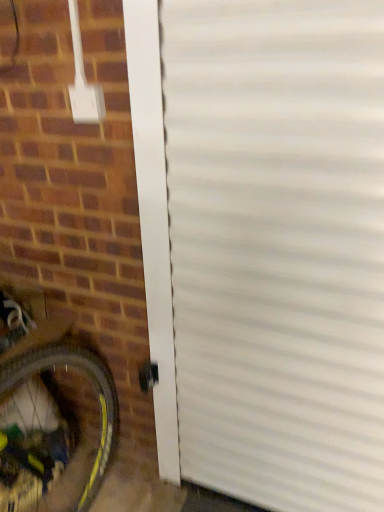
Locate an element on the screen. white corrugated door at center is located at coordinates (278, 247).

The image size is (384, 512). I want to click on brown brick at lower left, so click(77, 195).

You are a GUI agent. You are given a task and a screenshot of the screen. Output one action in this format:
    pyautogui.click(x=<x>, y=<y>)
    Task: Click on the white corrugated door at center
    
    Given the screenshot: What is the action you would take?
    click(x=278, y=247)

From the image's perspective, is white corrugated door at center under yellow rubber bicycle wheel at lower left?

No, from the image's perspective, white corrugated door at center is not below yellow rubber bicycle wheel at lower left.

Looking at this image, from a real-world perspective, is white corrugated door at center beneath yellow rubber bicycle wheel at lower left?

No, from a real-world perspective, white corrugated door at center is not under yellow rubber bicycle wheel at lower left.

Is the surface of white corrugated door at center in direct contact with yellow rubber bicycle wheel at lower left?

No.

The height and width of the screenshot is (512, 384). Identify the location of garage door lying in front of the yellow rubber bicycle wheel at lower left. (278, 247).

Is brown brick at lower left inside yellow rubber bicycle wheel at lower left?

No, brown brick at lower left is not a part of yellow rubber bicycle wheel at lower left.

Looking at their sizes, would you say yellow rubber bicycle wheel at lower left is wider or thinner than brown brick at lower left?

In the image, yellow rubber bicycle wheel at lower left appears to be more narrow than brown brick at lower left.

In the scene shown: Is yellow rubber bicycle wheel at lower left at the left side of brown brick at lower left?

Indeed, yellow rubber bicycle wheel at lower left is positioned on the left side of brown brick at lower left.

Is the surface of yellow rubber bicycle wheel at lower left in direct contact with brown brick at lower left?

yellow rubber bicycle wheel at lower left and brown brick at lower left are clearly separated.

Looking at this image, does yellow rubber bicycle wheel at lower left come in front of white corrugated door at center?

No.

Identify the location of garage door on the right of yellow rubber bicycle wheel at lower left. The width and height of the screenshot is (384, 512). (278, 247).

Consider the image. Considering the relative sizes of yellow rubber bicycle wheel at lower left and white corrugated door at center in the image provided, is yellow rubber bicycle wheel at lower left smaller than white corrugated door at center?

Result: Incorrect, yellow rubber bicycle wheel at lower left is not smaller in size than white corrugated door at center.

Considering the relative sizes of yellow rubber bicycle wheel at lower left and white corrugated door at center in the image provided, is yellow rubber bicycle wheel at lower left wider than white corrugated door at center?

Correct, the width of yellow rubber bicycle wheel at lower left exceeds that of white corrugated door at center.

Is white corrugated door at center to the left or to the right of brown brick at lower left in the image?

white corrugated door at center is to the right of brown brick at lower left.

Is point (366, 106) closer or farther from the camera than point (144, 312)?

Point (366, 106) is positioned closer to the camera compared to point (144, 312).

Is white corrugated door at center in contact with brown brick at lower left?

No, white corrugated door at center is not making contact with brown brick at lower left.

From the image's perspective, which one is positioned higher, white corrugated door at center or brown brick at lower left?

From the image's view, white corrugated door at center is above.

Looking at this image, from a real-world perspective, who is located lower, brown brick at lower left or white corrugated door at center?

brown brick at lower left is physically lower.

How different are the orientations of brown brick at lower left and white corrugated door at center in degrees?

87.1 degrees.

Is the depth of brown brick at lower left less than that of white corrugated door at center?

Yes, it is.

Between brown brick at lower left and white corrugated door at center, which one has less height?

brown brick at lower left is shorter.

From a real-world perspective, is brown brick at lower left located beneath yellow rubber bicycle wheel at lower left?

Actually, brown brick at lower left is physically above yellow rubber bicycle wheel at lower left in the real world.

Is brown brick at lower left thinner than yellow rubber bicycle wheel at lower left?

No, brown brick at lower left is not thinner than yellow rubber bicycle wheel at lower left.

Can you confirm if brown brick at lower left is positioned to the right of yellow rubber bicycle wheel at lower left?

Yes.

Who is shorter, brown brick at lower left or yellow rubber bicycle wheel at lower left?

Standing shorter between the two is yellow rubber bicycle wheel at lower left.

The height and width of the screenshot is (512, 384). Identify the location of garage door lying on the right of yellow rubber bicycle wheel at lower left. (278, 247).

Identify the location of bicycle wheel on the left of the brown brick at lower left. (55, 429).

Which object lies nearer to the anchor point white corrugated door at center, yellow rubber bicycle wheel at lower left or brown brick at lower left?

Based on the image, brown brick at lower left appears to be nearer to white corrugated door at center.

From the image, which object appears to be nearer to brown brick at lower left, yellow rubber bicycle wheel at lower left or white corrugated door at center?

The object closer to brown brick at lower left is yellow rubber bicycle wheel at lower left.

Looking at the image, which one is located closer to yellow rubber bicycle wheel at lower left, white corrugated door at center or brown brick at lower left?

brown brick at lower left is positioned closer to the anchor yellow rubber bicycle wheel at lower left.

Based on their spatial positions, is brown brick at lower left or yellow rubber bicycle wheel at lower left further from white corrugated door at center?

Among the two, yellow rubber bicycle wheel at lower left is located further to white corrugated door at center.

From the image, which object appears to be farther from brown brick at lower left, white corrugated door at center or yellow rubber bicycle wheel at lower left?

Among the two, white corrugated door at center is located further to brown brick at lower left.

From the image, which object appears to be farther from yellow rubber bicycle wheel at lower left, brown brick at lower left or white corrugated door at center?

white corrugated door at center is further to yellow rubber bicycle wheel at lower left.

Identify the location of brickwork situated between yellow rubber bicycle wheel at lower left and white corrugated door at center from left to right. The width and height of the screenshot is (384, 512). (77, 195).